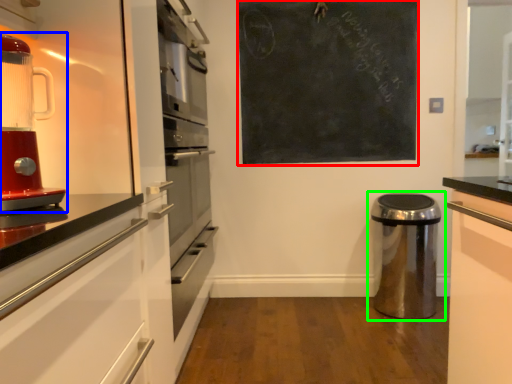
Question: Which object is the closest to the bulletin board (highlighted by a red box)? Choose among these: home appliance (highlighted by a blue box) or waste container (highlighted by a green box).

Choices:
 (A) home appliance
 (B) waste container

Answer: (B)